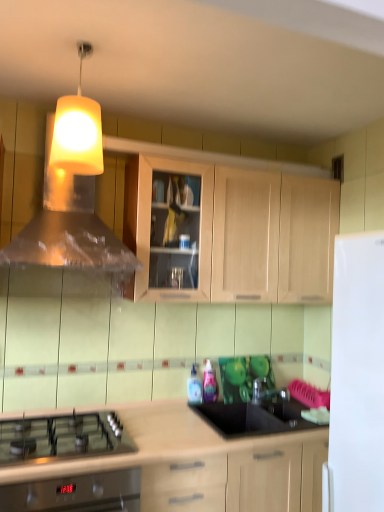
Question: Does yellow matte lampshade at upper center have a lesser width compared to light wood cabinet at lower center, the first cabinetry from the bottom?

Choices:
 (A) yes
 (B) no

Answer: (A)

Question: Is yellow matte lampshade at upper center not within light wood cabinet at lower center, the 2th cabinetry when ordered from top to bottom?

Choices:
 (A) no
 (B) yes

Answer: (B)

Question: Does yellow matte lampshade at upper center appear on the right side of light wood cabinet at lower center, the 2th cabinetry when ordered from top to bottom?

Choices:
 (A) yes
 (B) no

Answer: (B)

Question: Is yellow matte lampshade at upper center next to light wood cabinet at lower center, the first cabinetry from the bottom?

Choices:
 (A) no
 (B) yes

Answer: (A)

Question: Is yellow matte lampshade at upper center turned away from light wood cabinet at lower center, the 2th cabinetry when ordered from top to bottom?

Choices:
 (A) yes
 (B) no

Answer: (B)

Question: From the image's perspective, is yellow matte lampshade at upper center positioned above or below translucent plastic bottle at center, the 1th bottle from the left?

Choices:
 (A) below
 (B) above

Answer: (B)

Question: Which is correct: yellow matte lampshade at upper center is inside translucent plastic bottle at center, placed as the 2th bottle when sorted from right to left, or outside of it?

Choices:
 (A) inside
 (B) outside

Answer: (B)

Question: In terms of height, does yellow matte lampshade at upper center look taller or shorter compared to translucent plastic bottle at center, placed as the 2th bottle when sorted from right to left?

Choices:
 (A) tall
 (B) short

Answer: (A)

Question: In the image, is yellow matte lampshade at upper center on the left side or the right side of translucent plastic bottle at center, placed as the 2th bottle when sorted from right to left?

Choices:
 (A) right
 (B) left

Answer: (B)

Question: In terms of size, does light wood cabinet at upper center, which appears as the 1th cabinetry when viewed from the top, appear bigger or smaller than translucent plastic vent at upper center?

Choices:
 (A) big
 (B) small

Answer: (A)

Question: Is light wood cabinet at upper center, which ranks as the 2th cabinetry in bottom-to-top order, situated inside translucent plastic vent at upper center or outside?

Choices:
 (A) inside
 (B) outside

Answer: (B)

Question: Considering the positions of light wood cabinet at upper center, which ranks as the 2th cabinetry in bottom-to-top order, and translucent plastic vent at upper center in the image, is light wood cabinet at upper center, which ranks as the 2th cabinetry in bottom-to-top order, taller or shorter than translucent plastic vent at upper center?

Choices:
 (A) short
 (B) tall

Answer: (A)

Question: Based on their positions, is light wood cabinet at upper center, which ranks as the 2th cabinetry in bottom-to-top order, located to the left or right of translucent plastic vent at upper center?

Choices:
 (A) left
 (B) right

Answer: (B)

Question: In terms of height, does translucent plastic bottle at center, the 1th bottle from the left, look taller or shorter compared to translucent plastic bottle at center, marked as the first bottle in a right-to-left arrangement?

Choices:
 (A) short
 (B) tall

Answer: (A)

Question: Is translucent plastic bottle at center, placed as the 2th bottle when sorted from right to left, situated inside translucent plastic bottle at center, marked as the first bottle in a right-to-left arrangement, or outside?

Choices:
 (A) inside
 (B) outside

Answer: (B)